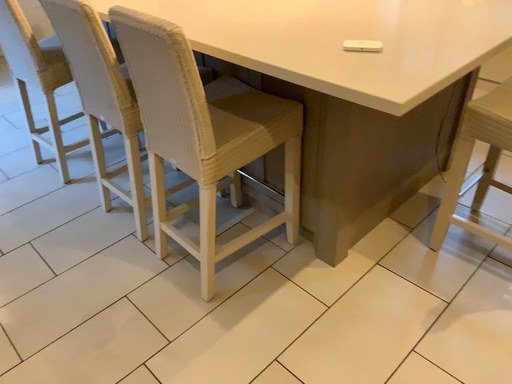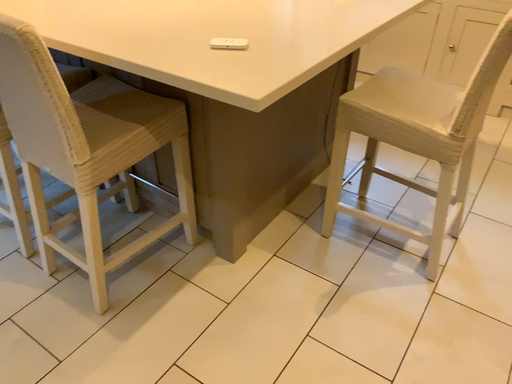
Question: Which way did the camera rotate in the video?

Choices:
 (A) rotated left
 (B) rotated right

Answer: (B)